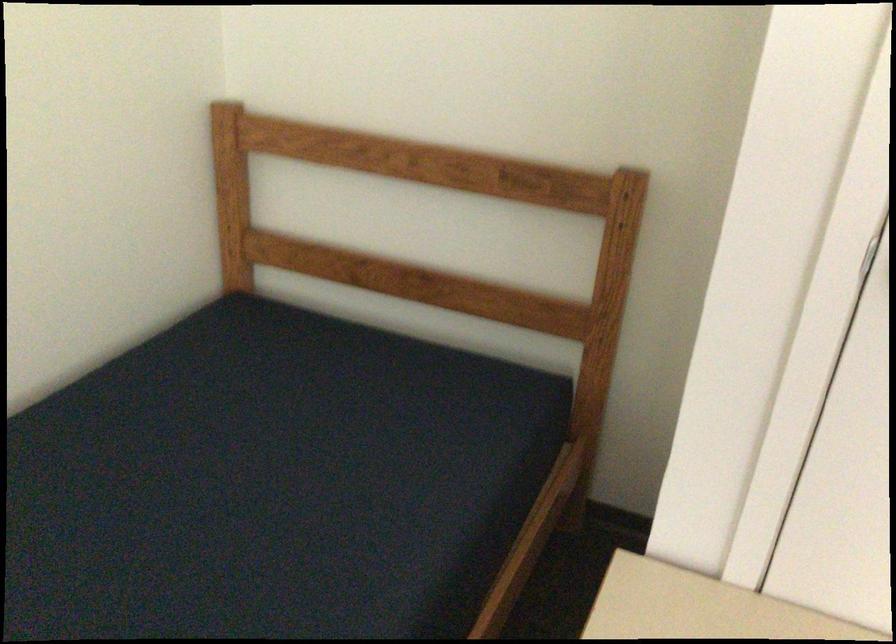
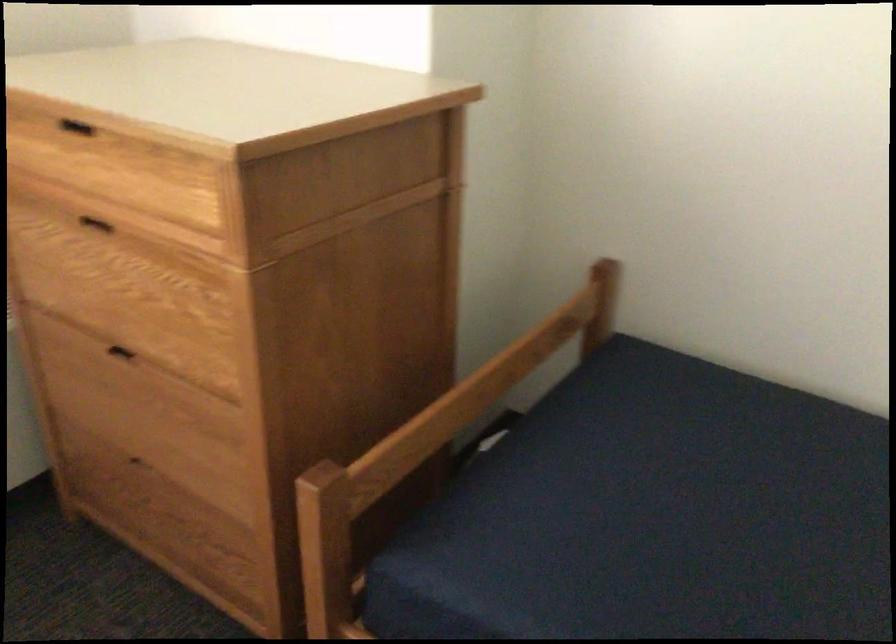
In the scene shown: Based on the continuous images, in which direction is the camera rotating?

The camera's rotation is toward left-down.